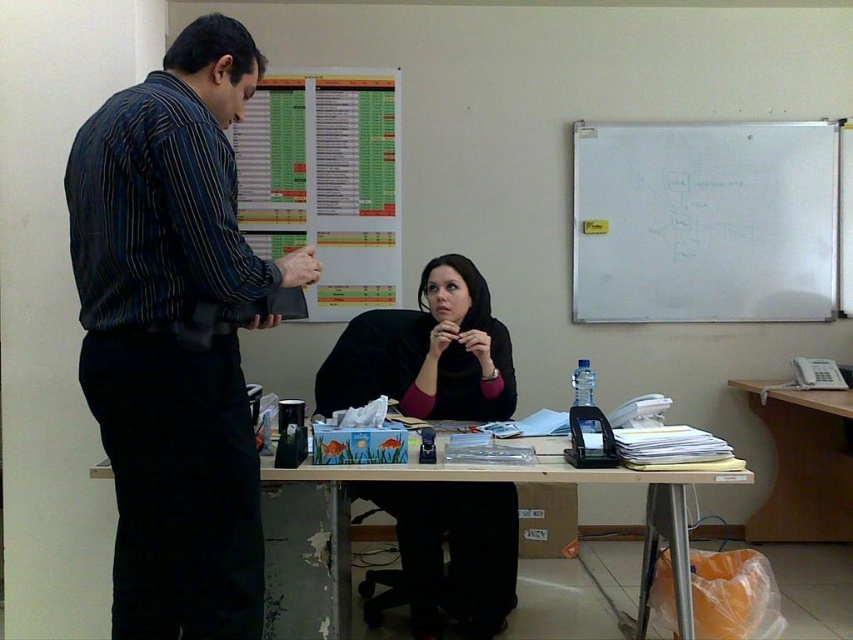
Measure the distance between point (677, 186) and camera.

Point (677, 186) is 12.18 feet from camera.

Can you confirm if white matte whiteboard at upper right is positioned above wooden table at center?

Indeed, white matte whiteboard at upper right is positioned over wooden table at center.

Measure the distance between white matte whiteboard at upper right and camera.

white matte whiteboard at upper right and camera are 3.69 meters apart.

You are a GUI agent. You are given a task and a screenshot of the screen. Output one action in this format:
    pyautogui.click(x=<x>, y=<y>)
    Task: Click on the white matte whiteboard at upper right
    The width and height of the screenshot is (853, 640).
    Given the screenshot: What is the action you would take?
    pyautogui.click(x=704, y=221)

Which is below, black matte hijab at center or wooden table at center?

wooden table at center is lower down.

Can you confirm if black matte hijab at center is taller than wooden table at center?

In fact, black matte hijab at center may be shorter than wooden table at center.

Between point (486, 554) and point (679, 506), which one is positioned in front?

Positioned in front is point (679, 506).

Identify the location of black matte hijab at center. (454, 552).

Is striped fabric shirt at left smaller than black matte hijab at center?

Incorrect, striped fabric shirt at left is not smaller in size than black matte hijab at center.

Can you confirm if striped fabric shirt at left is wider than black matte hijab at center?

Incorrect, striped fabric shirt at left's width does not surpass black matte hijab at center's.

Is point (109, 358) positioned before point (432, 520)?

Yes.

This screenshot has width=853, height=640. Find the location of `striped fabric shirt at left`. striped fabric shirt at left is located at coordinates (173, 336).